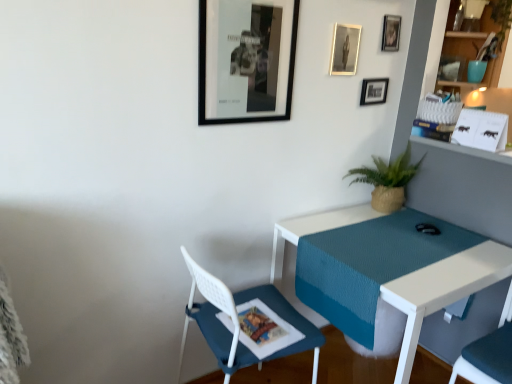
The height and width of the screenshot is (384, 512). In order to click on free space in front of green woven pot at right in this screenshot , I will do `click(398, 230)`.